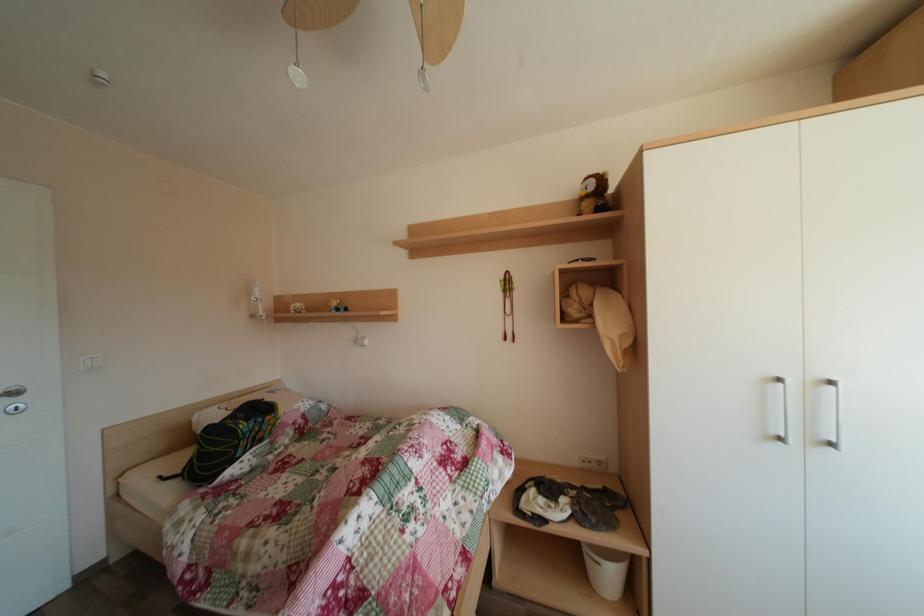
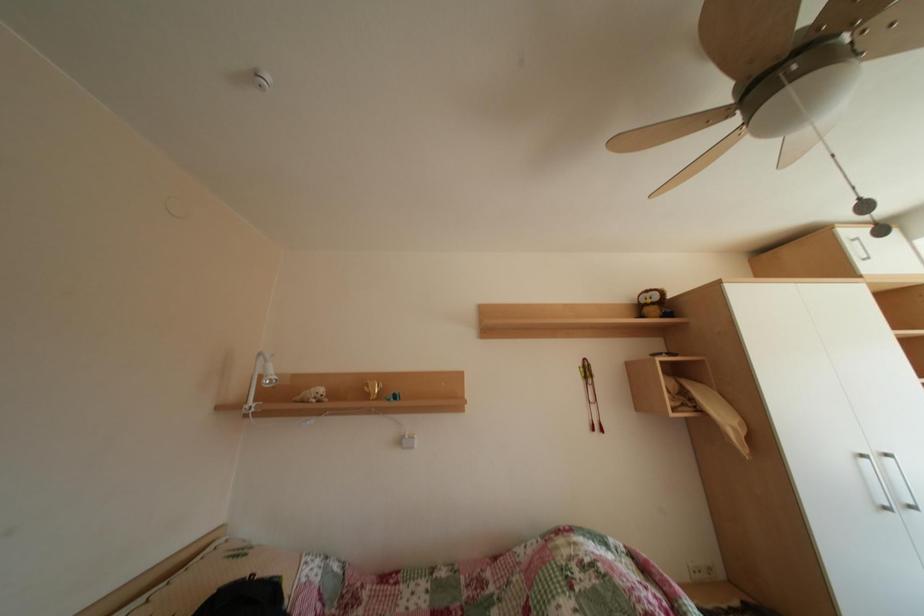
Question: In a continuous first-person perspective shot, in which direction is the camera moving?

Choices:
 (A) Left
 (B) Right
 (C) Forward
 (D) Backward

Answer: (A)